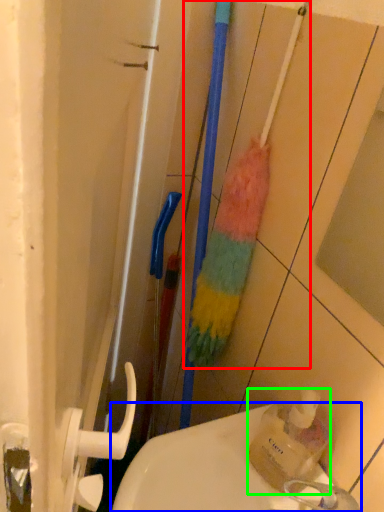
Question: Which object is the farthest from brush (highlighted by a red box)? Choose among these: sink (highlighted by a blue box) or bottle (highlighted by a green box).

Choices:
 (A) sink
 (B) bottle

Answer: (A)